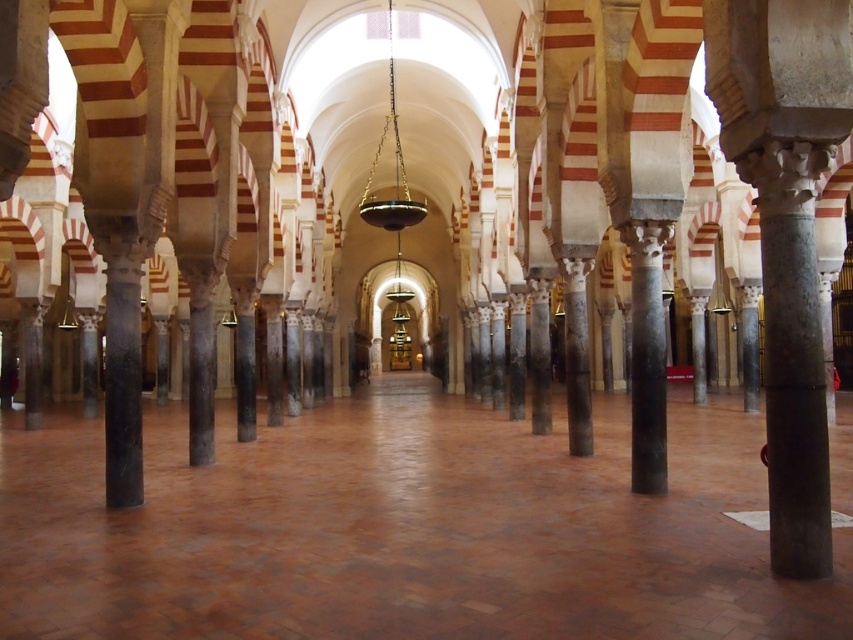
Question: Which object is closer to the camera taking this photo?

Choices:
 (A) marble column at center
 (B) black marble pillar at center

Answer: (A)

Question: Among these objects, which one is nearest to the camera?

Choices:
 (A) black marble pillar at center
 (B) marble column at center

Answer: (B)

Question: Is marble column at center bigger than black marble pillar at center?

Choices:
 (A) no
 (B) yes

Answer: (B)

Question: Where is marble column at center located in relation to black marble pillar at center in the image?

Choices:
 (A) right
 (B) left

Answer: (A)

Question: Is marble column at center smaller than black marble pillar at center?

Choices:
 (A) no
 (B) yes

Answer: (A)

Question: Which point appears closest to the camera in this image?

Choices:
 (A) (529, 364)
 (B) (575, 316)

Answer: (B)